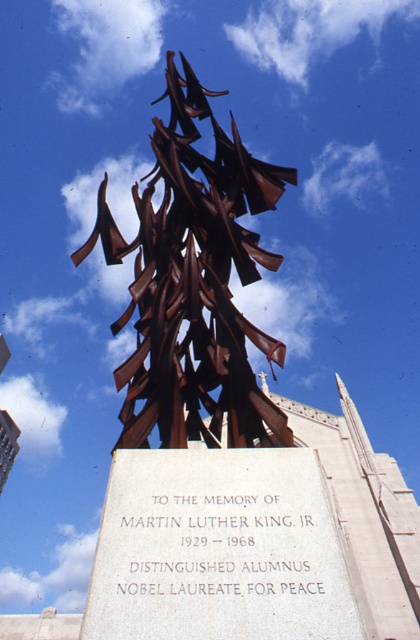
Is point (356, 618) closer to viewer compared to point (170, 51)?

Yes, it is.

Which is behind, point (151, 602) or point (180, 163)?

Positioned behind is point (180, 163).

The image size is (420, 640). Describe the element at coordinates (220, 548) in the screenshot. I see `white stone plaque at center` at that location.

Where is `white stone plaque at center`? The width and height of the screenshot is (420, 640). white stone plaque at center is located at coordinates (220, 548).